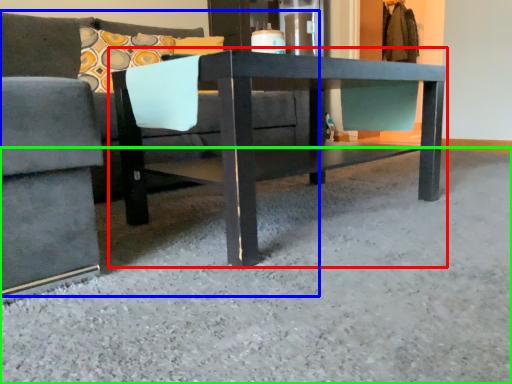
Question: Considering the real-world distances, which object is farthest from table (highlighted by a red box)? studio couch (highlighted by a blue box) or concrete (highlighted by a green box)?

Choices:
 (A) studio couch
 (B) concrete

Answer: (A)